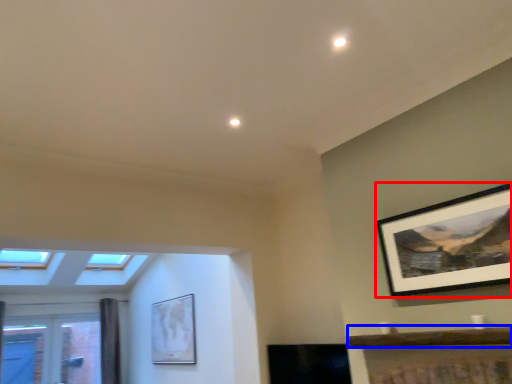
Question: Which object appears closest to the camera in this image, picture frame (highlighted by a red box) or window sill (highlighted by a blue box)?

Choices:
 (A) picture frame
 (B) window sill

Answer: (B)